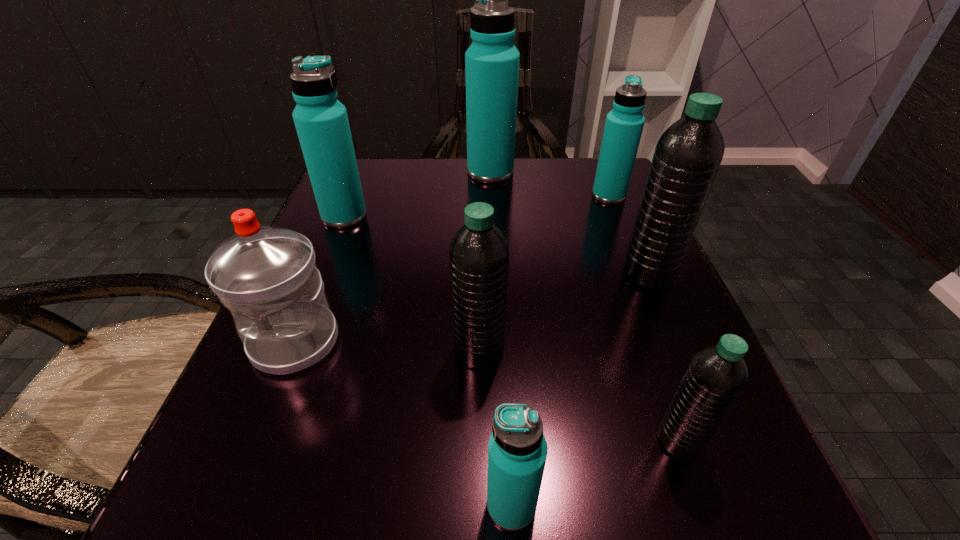
I want to click on free point between the biggest black water bottle and the rightmost blue water bottle, so (629, 234).

Locate an element on the screen. The height and width of the screenshot is (540, 960). free space between the third biggest blue water bottle and the nearest blue water bottle is located at coordinates (560, 350).

Find the location of a particular element. blank region between the farthest water bottle and the white water bottle is located at coordinates (393, 257).

This screenshot has height=540, width=960. What are the coordinates of `free area in between the leftmost black water bottle and the white water bottle` in the screenshot? It's located at 387,346.

This screenshot has height=540, width=960. I want to click on free space between the smallest blue water bottle and the leftmost blue water bottle, so click(x=428, y=361).

What are the coordinates of `free space between the second smallest blue water bottle and the nearest object` in the screenshot? It's located at (560, 350).

Identify the location of free space between the rightmost blue water bottle and the biggest black water bottle. (629, 234).

Select which object appears as the second closest to the second nearest black water bottle. Please provide its 2D coordinates. Your answer should be formatted as a tuple, i.e. [(x, y)], where the tuple contains the x and y coordinates of a point satisfying the conditions above.

[(267, 276)]

Identify which object is the second closest to the white water bottle. Please provide its 2D coordinates. Your answer should be formatted as a tuple, i.e. [(x, y)], where the tuple contains the x and y coordinates of a point satisfying the conditions above.

[(321, 121)]

Identify the location of water bottle that is the sixth closest one to the white water bottle. (688, 154).